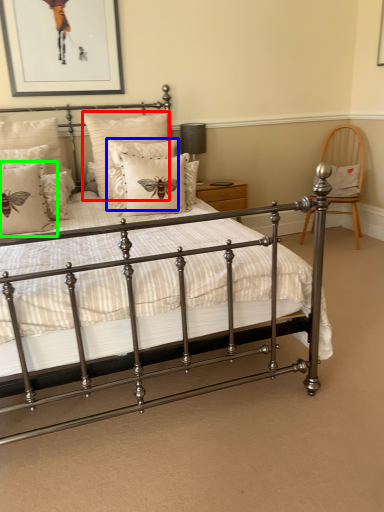
Question: Considering the real-world distances, which object is closest to pillow (highlighted by a red box)? pillow (highlighted by a blue box) or pillow (highlighted by a green box).

Choices:
 (A) pillow
 (B) pillow

Answer: (A)